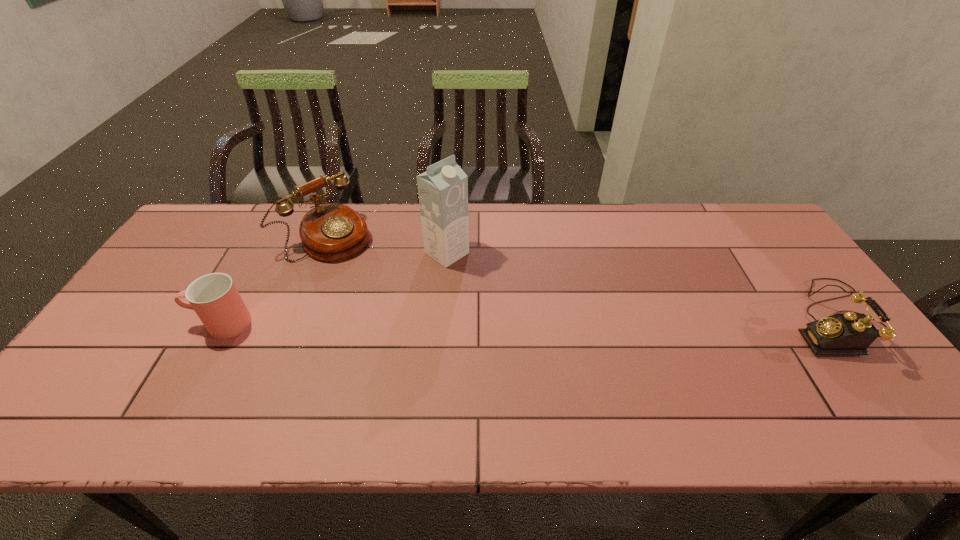
The width and height of the screenshot is (960, 540). I want to click on carton situated at the far edge, so 443,189.

At what (x,y) coordinates should I click in order to perform the action: click on object that is at the near edge. Please return your answer as a coordinate pair (x, y). This screenshot has height=540, width=960. Looking at the image, I should click on (839, 334).

Locate an element on the screen. The width and height of the screenshot is (960, 540). object located in the right edge section of the desktop is located at coordinates (839, 334).

You are a GUI agent. You are given a task and a screenshot of the screen. Output one action in this format:
    pyautogui.click(x=<x>, y=<y>)
    Task: Click on the object situated at the near right corner
    The image size is (960, 540).
    Given the screenshot: What is the action you would take?
    pyautogui.click(x=839, y=334)

In the image, there is a desktop. Where is `vacant space at the far edge`? This screenshot has height=540, width=960. vacant space at the far edge is located at coordinates (525, 217).

Where is `free space at the near edge`? The height and width of the screenshot is (540, 960). free space at the near edge is located at coordinates (386, 394).

In order to click on blank space at the left edge of the desktop in this screenshot , I will do `click(116, 347)`.

Identify the location of vacant region at the far left corner of the desktop. The width and height of the screenshot is (960, 540). (223, 204).

Identify the location of vacant area at the near left corner of the desktop. (137, 386).

Locate an element on the screen. The height and width of the screenshot is (540, 960). free space at the far right corner of the desktop is located at coordinates (729, 242).